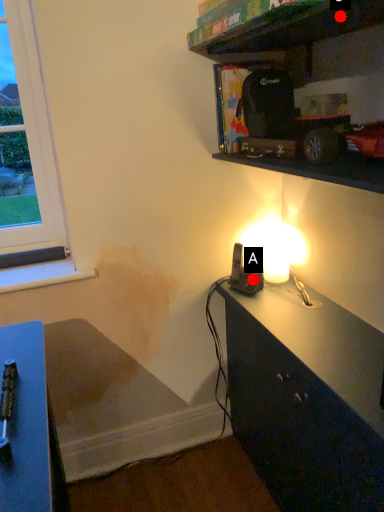
Question: Two points are circled on the image, labeled by A and B beside each circle. Among these points, which one is nearest to the camera?

Choices:
 (A) A is closer
 (B) B is closer

Answer: (B)